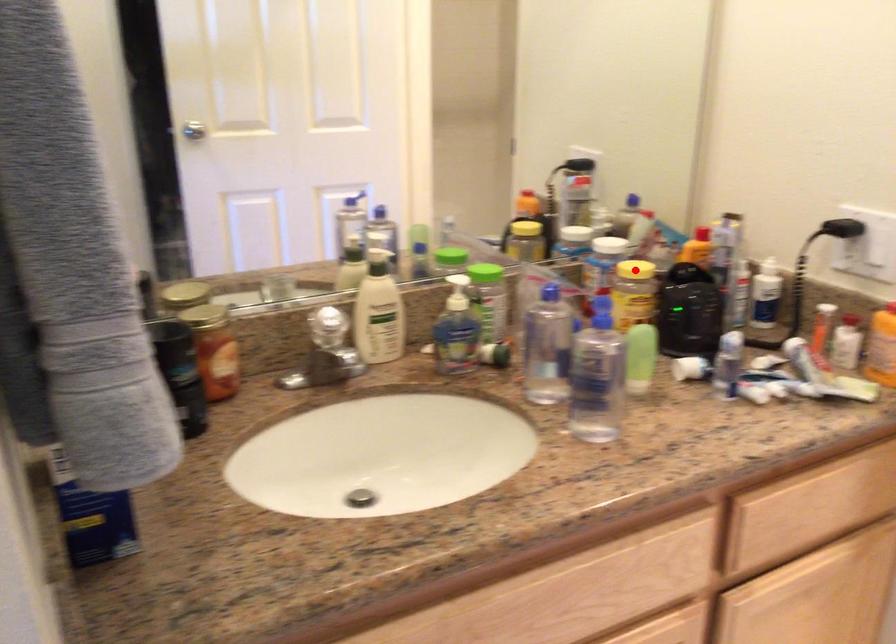
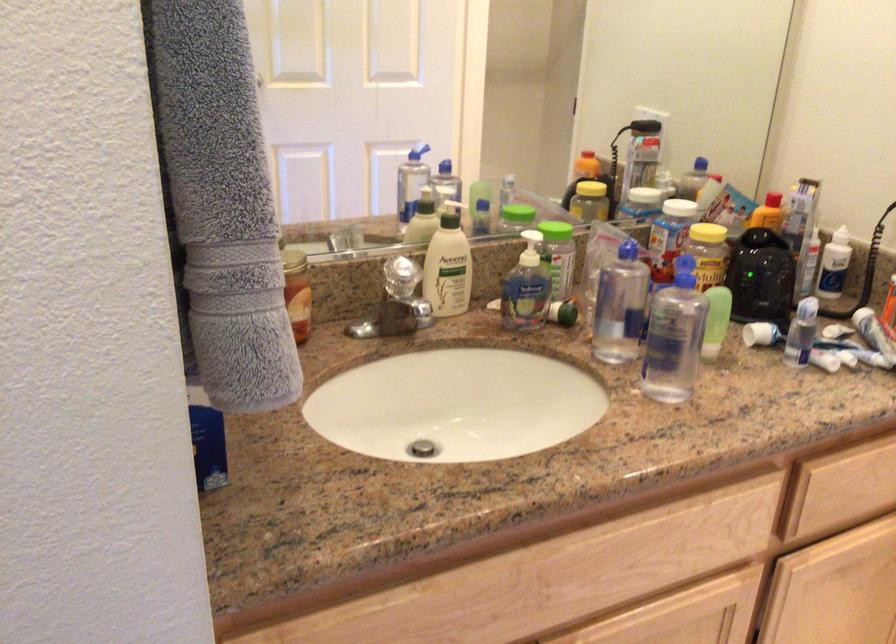
Question: I am providing you with two images of the same scene from different viewpoints. A red point is marked on the first image. Can you still see the location of the red point in image 2?

Choices:
 (A) Yes
 (B) No

Answer: (A)